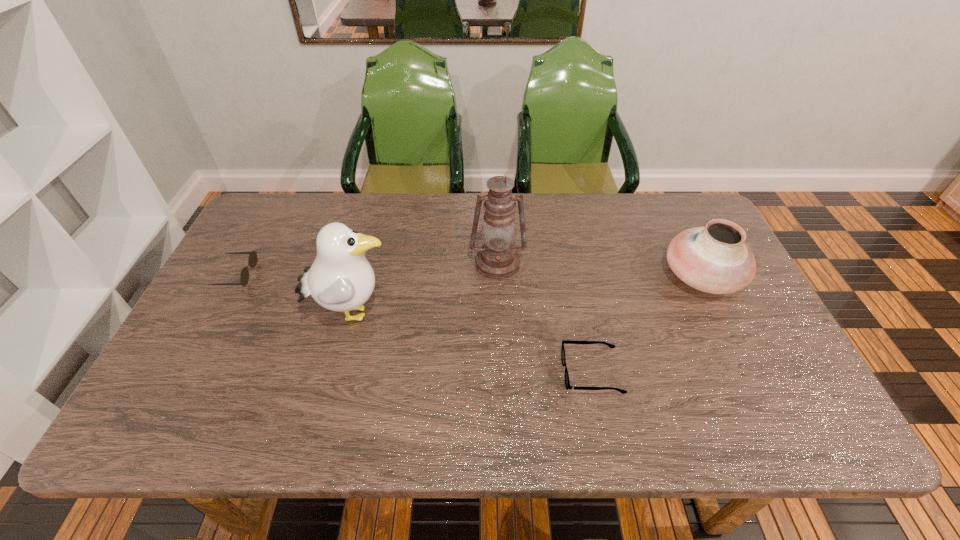
Identify which object is located as the third nearest to the sunglasses. Please provide its 2D coordinates. Your answer should be formatted as a tuple, i.e. [(x, y)], where the tuple contains the x and y coordinates of a point satisfying the conditions above.

[(567, 383)]

Select which object is the second closest to the gull. Please provide its 2D coordinates. Your answer should be formatted as a tuple, i.e. [(x, y)], where the tuple contains the x and y coordinates of a point satisfying the conditions above.

[(497, 258)]

You are a GUI agent. You are given a task and a screenshot of the screen. Output one action in this format:
    pyautogui.click(x=<x>, y=<y>)
    Task: Click on the vacant space that satisfies the following two spatial constraints: 1. on the front-facing side of the rightmost object; 2. on the left side of the sunglasses
    The image size is (960, 540).
    Given the screenshot: What is the action you would take?
    pyautogui.click(x=235, y=276)

Where is `free location that satisfies the following two spatial constraints: 1. on the front-facing side of the third shortest object; 2. on the left side of the leftmost object`? free location that satisfies the following two spatial constraints: 1. on the front-facing side of the third shortest object; 2. on the left side of the leftmost object is located at coordinates (235, 276).

The height and width of the screenshot is (540, 960). I want to click on vacant space that satisfies the following two spatial constraints: 1. on the front side of the pottery; 2. on the left side of the third object from left to right, so click(498, 276).